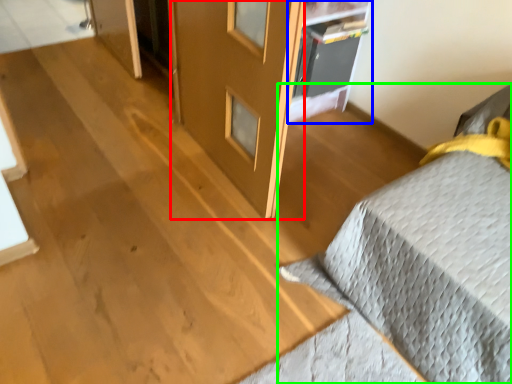
Question: Which is farther away from screen door (highlighted by a red box)? shelf (highlighted by a blue box) or furniture (highlighted by a green box)?

Choices:
 (A) shelf
 (B) furniture

Answer: (B)